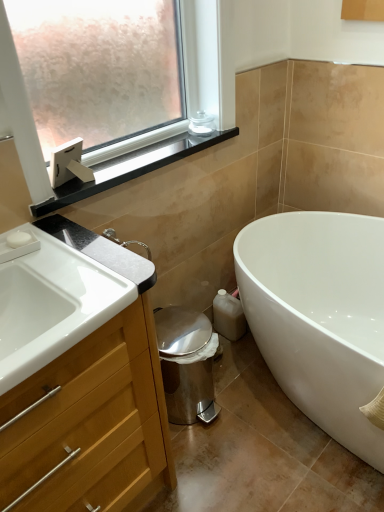
Question: In terms of width, does wooden cabinet at left look wider or thinner when compared to white glossy bathtub at lower right?

Choices:
 (A) thin
 (B) wide

Answer: (A)

Question: From a real-world perspective, is wooden cabinet at left physically located above or below white glossy bathtub at lower right?

Choices:
 (A) above
 (B) below

Answer: (A)

Question: Which of these objects is positioned farthest from the clear glass jar at upper center?

Choices:
 (A) wooden cabinet at left
 (B) white matte soap at upper left
 (C) black glossy window sill at upper left
 (D) white glossy sink at lower left
 (E) white glossy bathtub at lower right

Answer: (A)

Question: Based on their relative distances, which object is farther from the white matte soap at upper left?

Choices:
 (A) wooden cabinet at left
 (B) clear glass jar at upper center
 (C) black glossy window sill at upper left
 (D) white glossy bathtub at lower right
 (E) white glossy sink at lower left

Answer: (D)